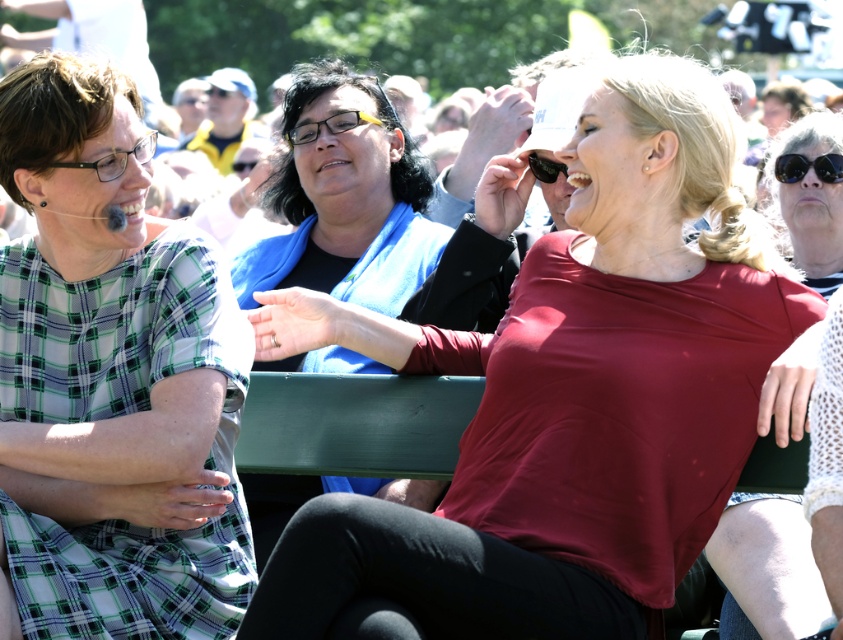
Consider the image. Is matte red shirt at center positioned in front of matte black glasses at left?

Yes, matte red shirt at center is in front of matte black glasses at left.

Does matte red shirt at center appear on the right side of matte black glasses at left?

→ Indeed, matte red shirt at center is positioned on the right side of matte black glasses at left.

Locate an element on the screen. matte red shirt at center is located at coordinates [x=567, y=396].

Locate an element on the screen. The height and width of the screenshot is (640, 843). matte red shirt at center is located at coordinates (567, 396).

Is green plaid dress at left shorter than matte white blouse at center?

In fact, green plaid dress at left may be taller than matte white blouse at center.

Does green plaid dress at left have a larger size compared to matte white blouse at center?

Yes.

Who is more forward, (83, 176) or (728, 564)?

Point (83, 176) is more forward.

The width and height of the screenshot is (843, 640). Find the location of `green plaid dress at left`. green plaid dress at left is located at coordinates tap(105, 296).

Which is more to the right, black reflective sunglasses at upper right or matte black glasses at left?

From the viewer's perspective, black reflective sunglasses at upper right appears more on the right side.

Does point (788, 173) come behind point (108, 161)?

That is True.

This screenshot has height=640, width=843. I want to click on black reflective sunglasses at upper right, so click(x=808, y=168).